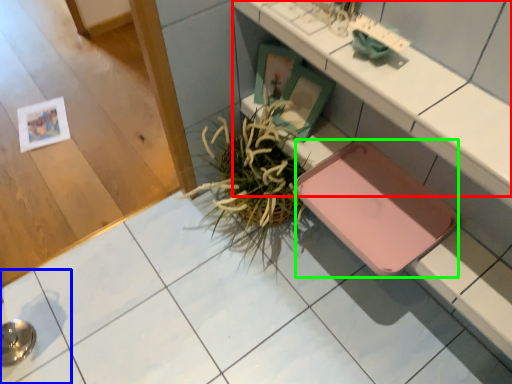
Question: Considering the real-world distances, which object is farthest from counter (highlighted by a red box)? square (highlighted by a blue box) or pad (highlighted by a green box)?

Choices:
 (A) square
 (B) pad

Answer: (A)